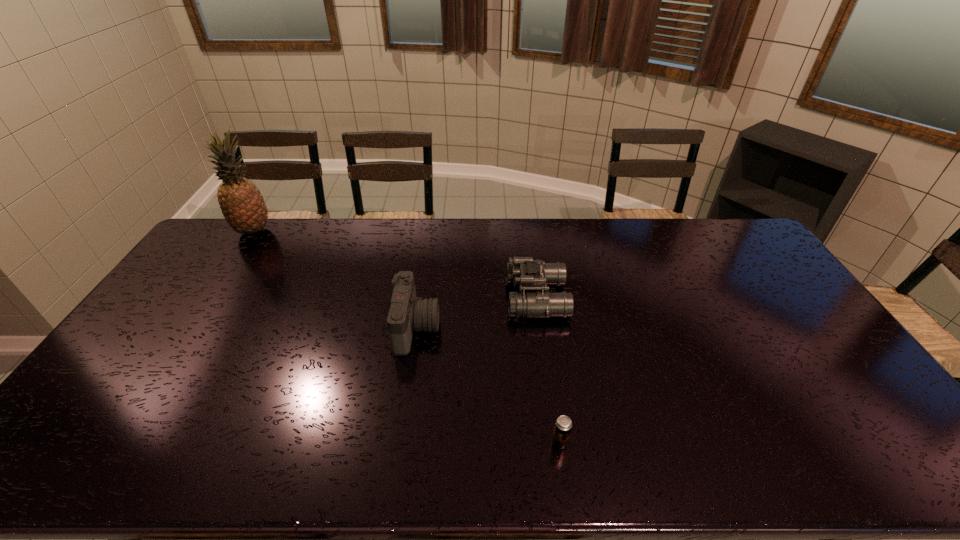
At what (x,y) coordinates should I click in order to perform the action: click on vacant space that is in between the tallest object and the camera. Please return your answer as a coordinate pair (x, y). The image size is (960, 540). Looking at the image, I should click on (335, 279).

Point out which object is positioned as the second nearest to the leftmost object. Please provide its 2D coordinates. Your answer should be formatted as a tuple, i.e. [(x, y)], where the tuple contains the x and y coordinates of a point satisfying the conditions above.

[(529, 274)]

At what (x,y) coordinates should I click in order to perform the action: click on object that can be found as the third closest to the binoculars. Please return your answer as a coordinate pair (x, y). This screenshot has height=540, width=960. Looking at the image, I should click on (243, 206).

Image resolution: width=960 pixels, height=540 pixels. I want to click on vacant point that satisfies the following two spatial constraints: 1. at the lens of the shortest object; 2. on the right side of the second object from left to right, so click(x=400, y=442).

Identify the location of vacant area in the image that satisfies the following two spatial constraints: 1. on the back side of the beer can; 2. at the lens of the camera. The width and height of the screenshot is (960, 540). (543, 328).

Where is `free space in the image that satisfies the following two spatial constraints: 1. at the lens of the camera; 2. on the right side of the beer can`? free space in the image that satisfies the following two spatial constraints: 1. at the lens of the camera; 2. on the right side of the beer can is located at coordinates (400, 442).

At what (x,y) coordinates should I click in order to perform the action: click on free space that satisfies the following two spatial constraints: 1. at the lens of the shortest object; 2. on the left side of the second object from left to right. Please return your answer as a coordinate pair (x, y). The height and width of the screenshot is (540, 960). Looking at the image, I should click on (400, 442).

The width and height of the screenshot is (960, 540). I want to click on vacant space that satisfies the following two spatial constraints: 1. on the back side of the beer can; 2. through the lenses of the binoculars, so (x=539, y=298).

What are the coordinates of `free location that satisfies the following two spatial constraints: 1. at the lens of the nearest object; 2. on the right side of the third object from right to left` in the screenshot? It's located at (400, 442).